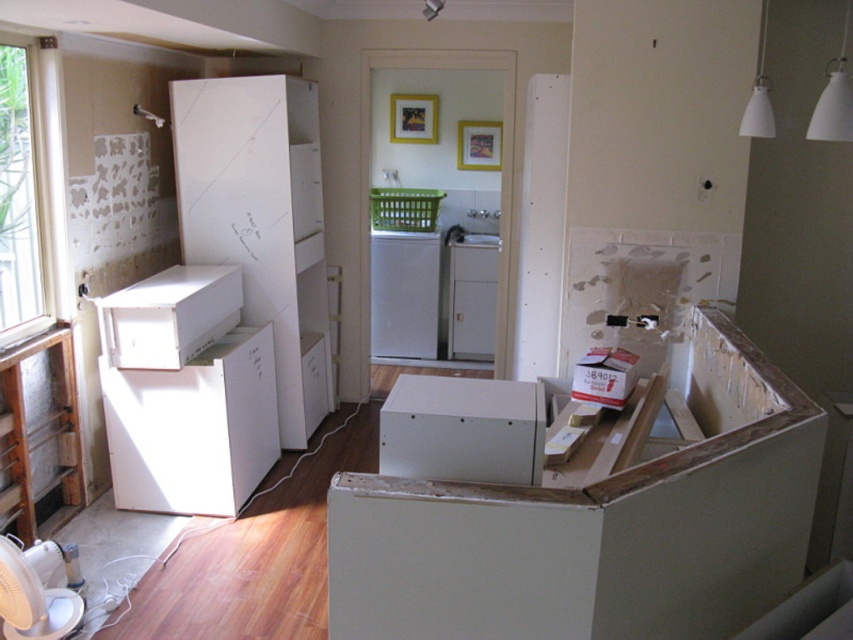
From the picture: You are moving into a new apartment and need to place the white glossy refrigerator at center and the white cardboard box at center in the room. According to the scene, which object is positioned to the left side of the other?

The white glossy refrigerator at center is to the left of the white cardboard box at center.

You are standing in the middle of the room and want to reach both points. Which point, point (450, 355) or point (601, 358), will you reach first?

Point (450, 355) is closer to you than point (601, 358), so you will reach point (450, 355) first.